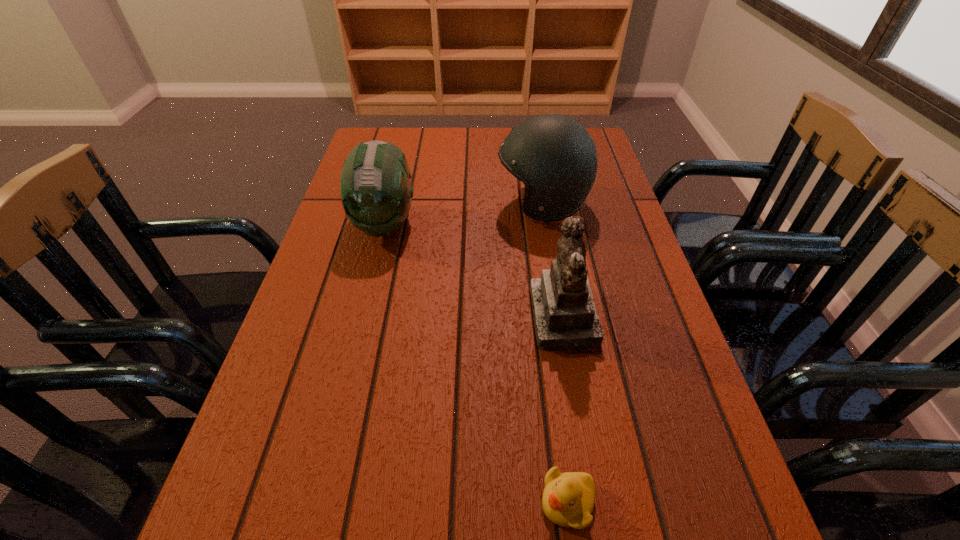
This screenshot has width=960, height=540. Find the location of `free space located on the front-facing side of the figurine`. free space located on the front-facing side of the figurine is located at coordinates (360, 319).

This screenshot has height=540, width=960. What are the coordinates of `free space located on the front-facing side of the figurine` in the screenshot? It's located at (379, 319).

Locate an element on the screen. free space located 0.330m on the visor of the left football helmet is located at coordinates (348, 372).

This screenshot has width=960, height=540. I want to click on vacant region located 0.130m on the beak of the shortest object, so click(x=452, y=502).

Locate an element on the screen. Image resolution: width=960 pixels, height=540 pixels. blank area located on the beak of the shortest object is located at coordinates pyautogui.click(x=500, y=502).

Where is `vacant region located 0.360m on the beak of the shortest object`? vacant region located 0.360m on the beak of the shortest object is located at coordinates (297, 502).

Where is `object situated at the left edge`? This screenshot has width=960, height=540. object situated at the left edge is located at coordinates (376, 192).

Locate an element on the screen. Image resolution: width=960 pixels, height=540 pixels. football helmet that is positioned at the right edge is located at coordinates (554, 156).

Where is `figurine present at the right edge`? This screenshot has height=540, width=960. figurine present at the right edge is located at coordinates (565, 317).

Image resolution: width=960 pixels, height=540 pixels. I want to click on vacant region at the left edge of the desktop, so coord(341,202).